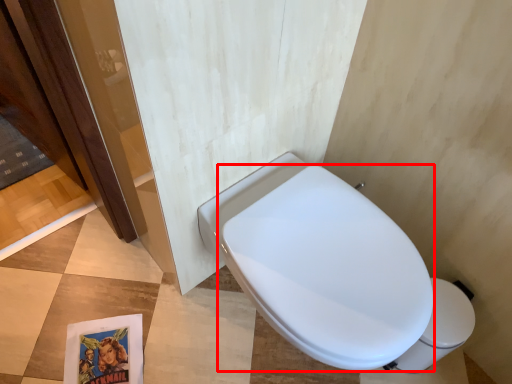
Question: Considering the relative positions of bidet (annotated by the red box) and toilet bowl in the image provided, where is bidet (annotated by the red box) located with respect to the staircase?

Choices:
 (A) left
 (B) right

Answer: (A)